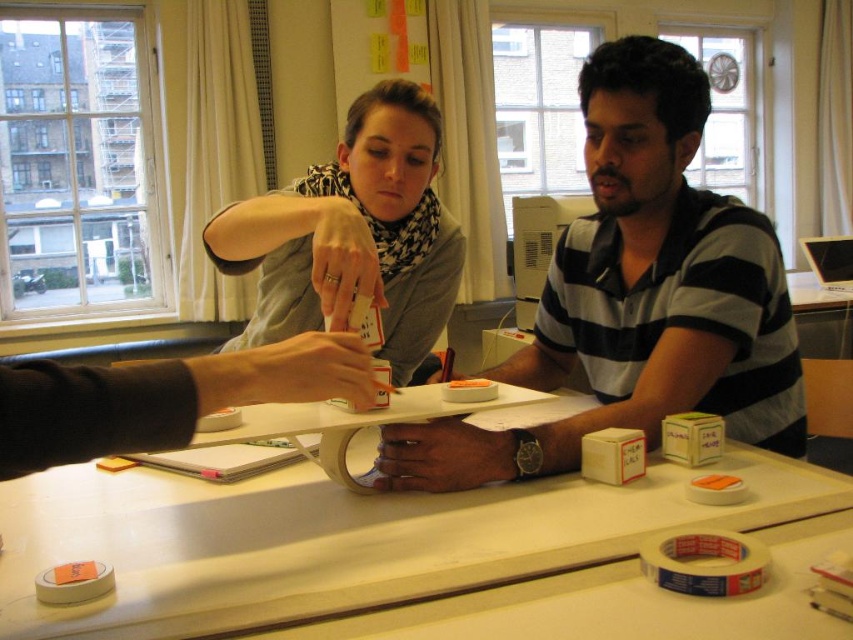
You are a delivery person who just arrived at the office. You need to place a small package on the white matte table at center. However, there is a matte black scarf at upper center nearby. Can you safely place the package on the table without disturbing the scarf?

The white matte table at center is 14.29 inches away from the matte black scarf at upper center. Since the distance is sufficient, you can safely place the package on the table without disturbing the scarf.

You are a person standing at the edge of the room looking towards the white matte table at center and the striped cotton polo shirt at center. Which object is closer to the floor?

The white matte table at center is closer to the floor because it is not as tall as the striped cotton polo shirt at center.

You are organizing a small event and need to place a rectangular box that is 2 feet wide on the table. Given the white matte table at center and the matte black scarf at upper center, can the box fit on the table without overlapping the scarf?

The white matte table at center might be wider than matte black scarf at upper center, so there is a possibility that the box can fit without overlapping the scarf. However, the exact dimensions are uncertain based on the provided information.